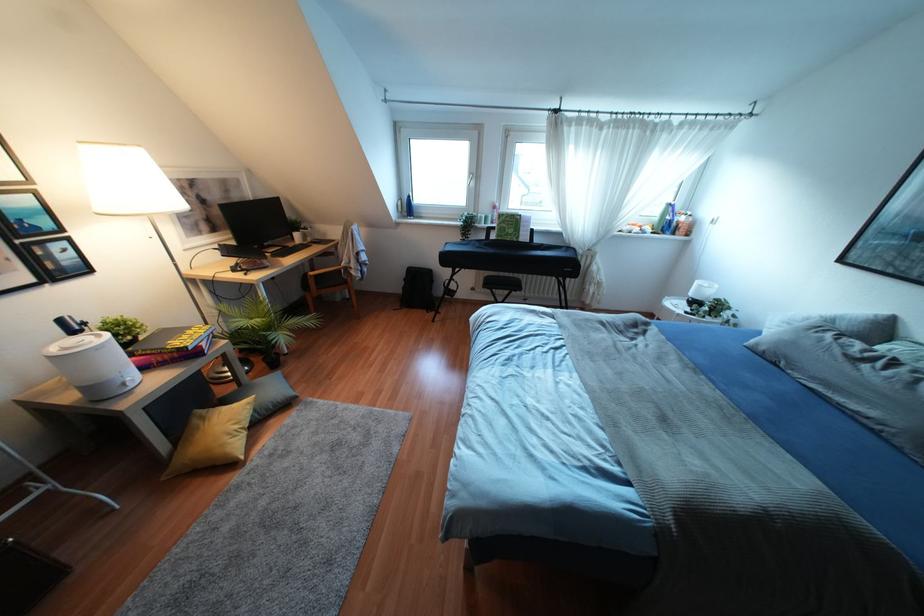
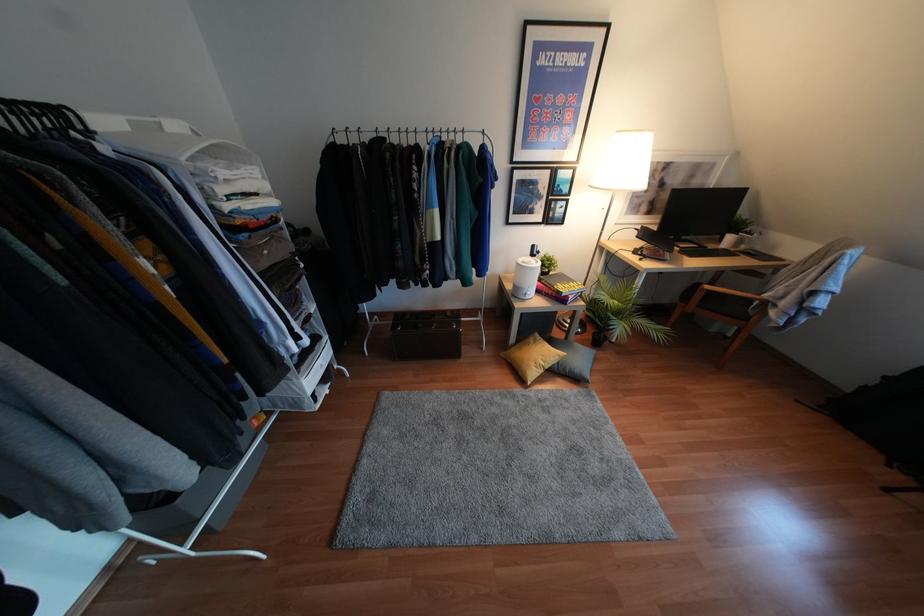
The point at (310,273) is marked in the first image. Where is the corresponding point in the second image?

(707, 286)